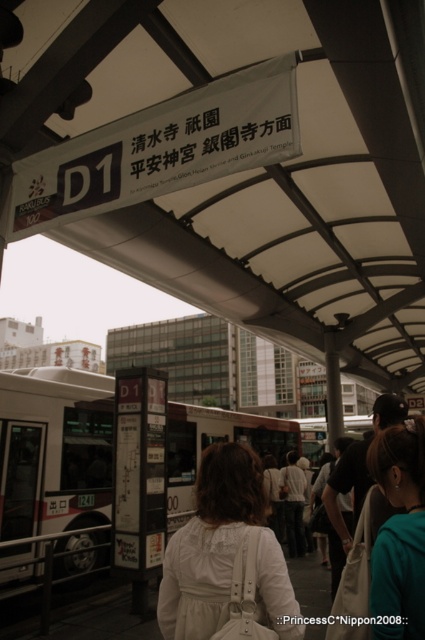
You are a tourist at the bus station and want to board the white plastic bus at center. You are currently standing next to the white fabric dress at center. Which direction should you move to reach the bus?

The white plastic bus at center is located below the white fabric dress at center, so you should move downward or forward to reach it.